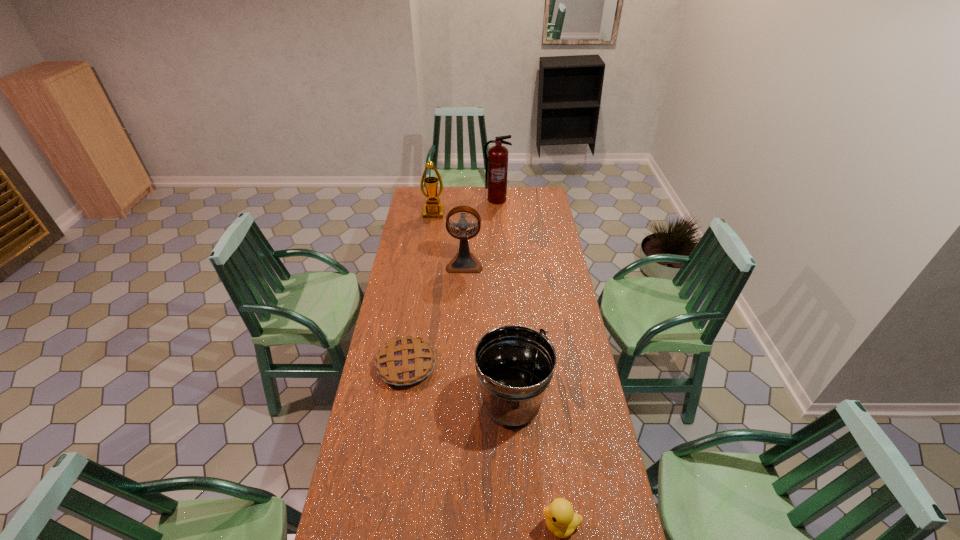
Image resolution: width=960 pixels, height=540 pixels. Identify the location of vacant space that is in between the fire extinguisher and the third farthest object. (480, 232).

Where is `object that ranks as the third closest to the bucket`? Image resolution: width=960 pixels, height=540 pixels. object that ranks as the third closest to the bucket is located at coordinates (464, 261).

At what (x,y) coordinates should I click in order to perform the action: click on the closest object relative to the tallest object. Please return your answer as a coordinate pair (x, y). The height and width of the screenshot is (540, 960). Looking at the image, I should click on (433, 209).

This screenshot has height=540, width=960. In order to click on free space in the image that satisfies the following two spatial constraints: 1. on the side of the tallest object with the handle and hose; 2. on the right side of the bucket in this screenshot , I will do `click(508, 404)`.

You are a GUI agent. You are given a task and a screenshot of the screen. Output one action in this format:
    pyautogui.click(x=<x>, y=<y>)
    Task: Click on the vacant space that satisfies the following two spatial constraints: 1. on the side of the bucket with the handle and hose; 2. on the right side of the tallest object
    This screenshot has height=540, width=960.
    Given the screenshot: What is the action you would take?
    pyautogui.click(x=508, y=404)

The height and width of the screenshot is (540, 960). What are the coordinates of `free space that satisfies the following two spatial constraints: 1. on the front-facing side of the bucket; 2. on the left side of the fifth nearest object` in the screenshot? It's located at (406, 404).